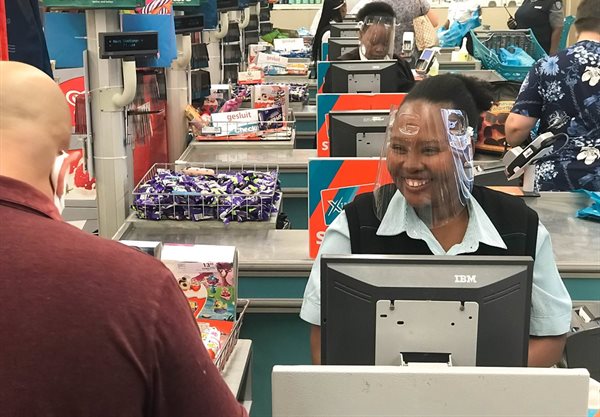
Where is `computer`? This screenshot has height=417, width=600. computer is located at coordinates (419, 310), (373, 133), (353, 73), (339, 50), (340, 30).